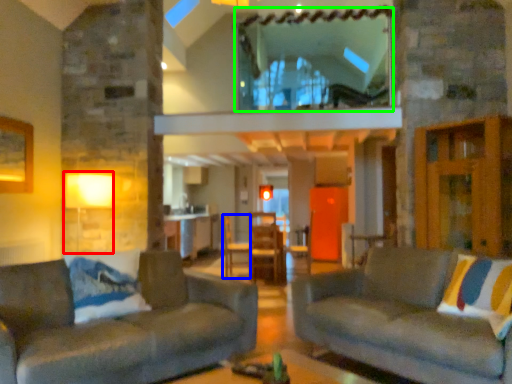
Question: Which object is positioned closest to lamp (highlighted by a red box)? Select from armchair (highlighted by a blue box) and window (highlighted by a green box).

Choices:
 (A) armchair
 (B) window

Answer: (B)